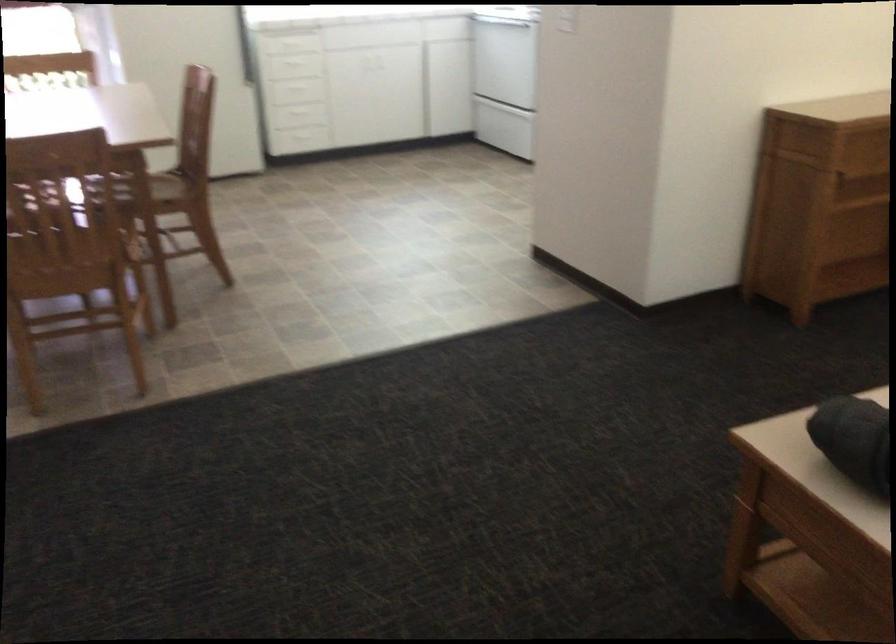
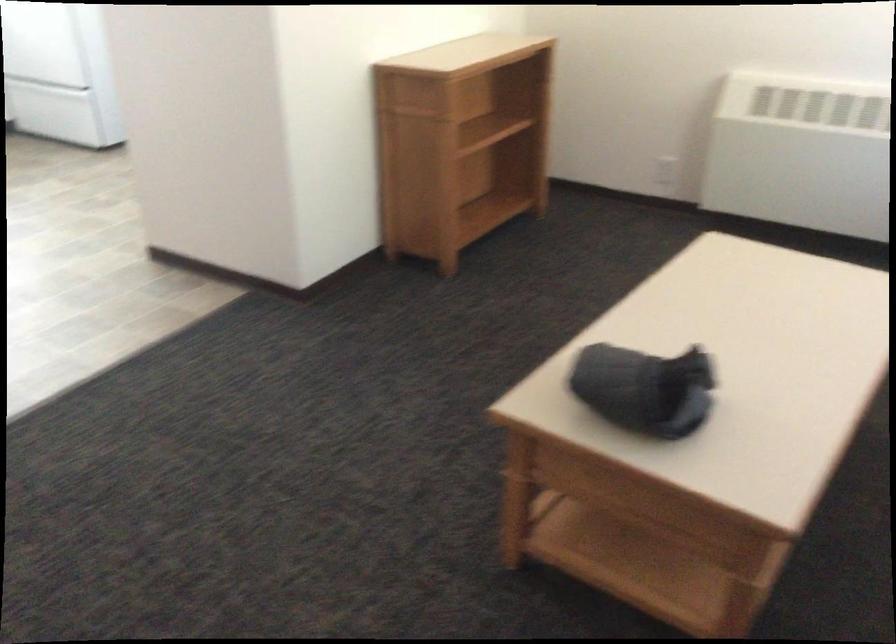
Question: How did the camera likely rotate?

Choices:
 (A) Left
 (B) Right
 (C) Up
 (D) Down

Answer: (B)